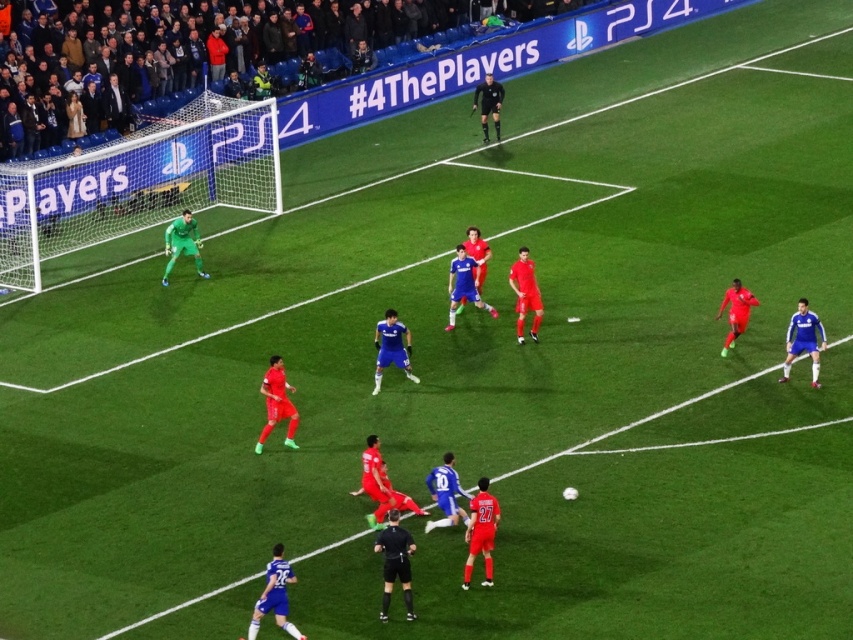
You are a soccer player on the red team trying to score a goal. You see the white net at left and the blue jersey player at center. Which one is closer to your position on the field?

The white net at left is closer to your position on the field because it has a smaller size compared to the blue jersey player at center, indicating it is nearer.

You are a soccer referee observing the match. You notice the dark blue fabric crowd at upper left and the blue matte jersey at center. Which object is located higher in the image?

The dark blue fabric crowd at upper left is positioned over the blue matte jersey at center, so it is higher in the image.

You are a soccer referee observing the match. You notice the shiny red jersey at center and the blue matte jersey at center. Which player is closer to the ball?

The shiny red jersey at center is positioned under the blue matte jersey at center, meaning the shiny red jersey at center is closer to the ball.